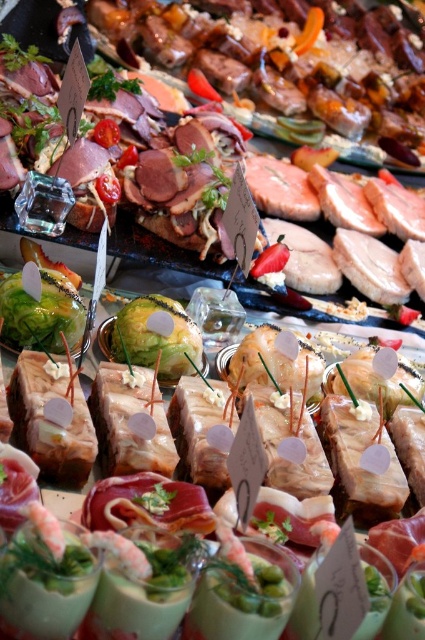
Does shiny brown meat at upper center appear on the right side of green leafy vegetable at center?

Indeed, shiny brown meat at upper center is positioned on the right side of green leafy vegetable at center.

Does point (379, 90) come behind point (200, 358)?

Yes, point (379, 90) is farther from viewer.

What do you see at coordinates (289, 61) in the screenshot?
I see `shiny brown meat at upper center` at bounding box center [289, 61].

Identify the location of shiny brown meat at upper center. (289, 61).